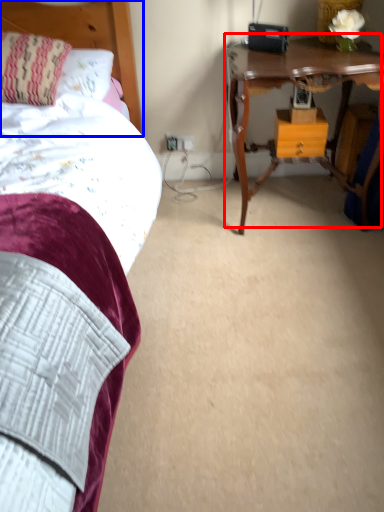
Question: Which object appears closest to the camera in this image, table (highlighted by a red box) or headboard (highlighted by a blue box)?

Choices:
 (A) table
 (B) headboard

Answer: (A)